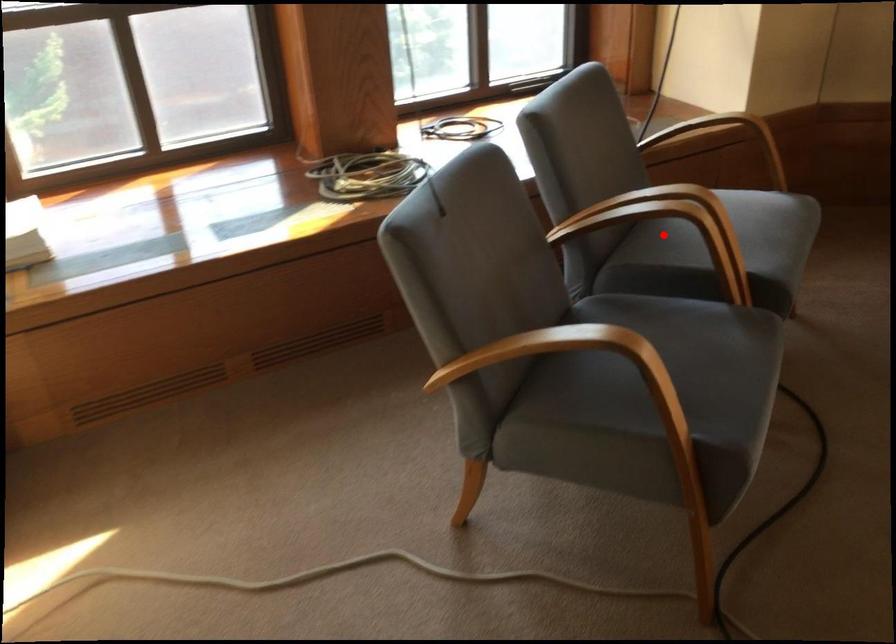
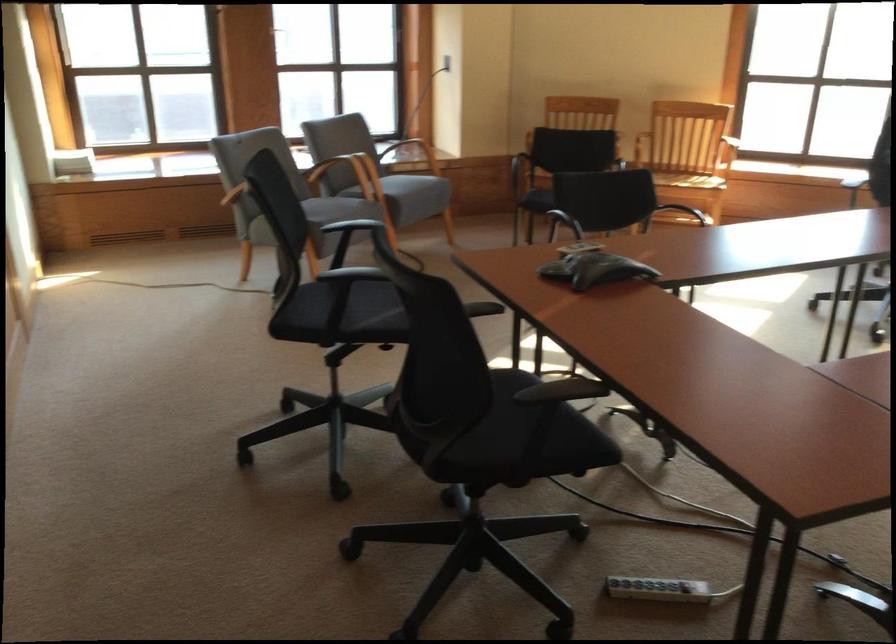
Question: I am providing you with two images of the same scene from different viewpoints. A red point is marked on the first image. Is the red point's position out of view in image 2?

Choices:
 (A) Yes
 (B) No

Answer: (A)